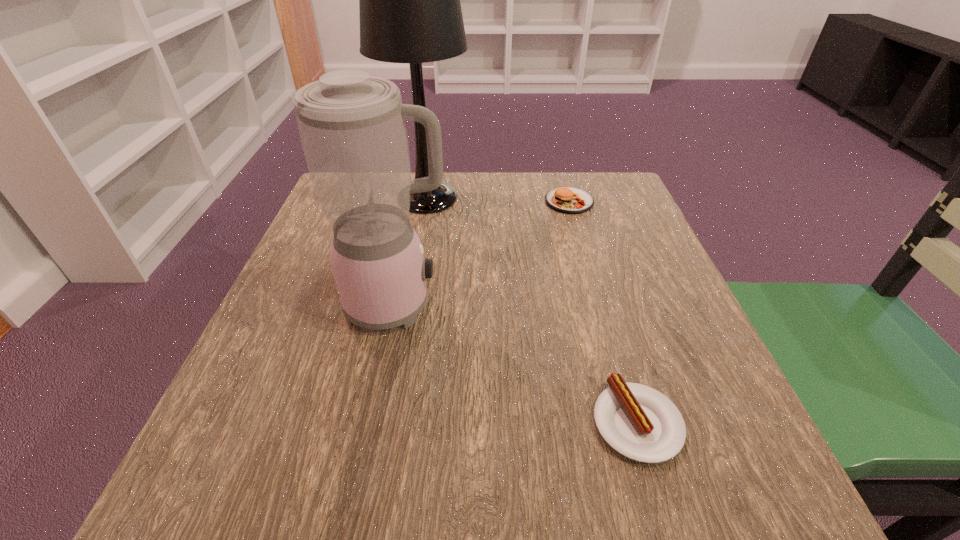
Locate an element on the screen. The width and height of the screenshot is (960, 540). free space in the image that satisfies the following two spatial constraints: 1. on the front side of the third tallest object; 2. on the left side of the nearest object is located at coordinates (633, 422).

The width and height of the screenshot is (960, 540). In order to click on vacant space that satisfies the following two spatial constraints: 1. on the front side of the table lamp; 2. on the left side of the sausage in this screenshot , I will do `click(389, 422)`.